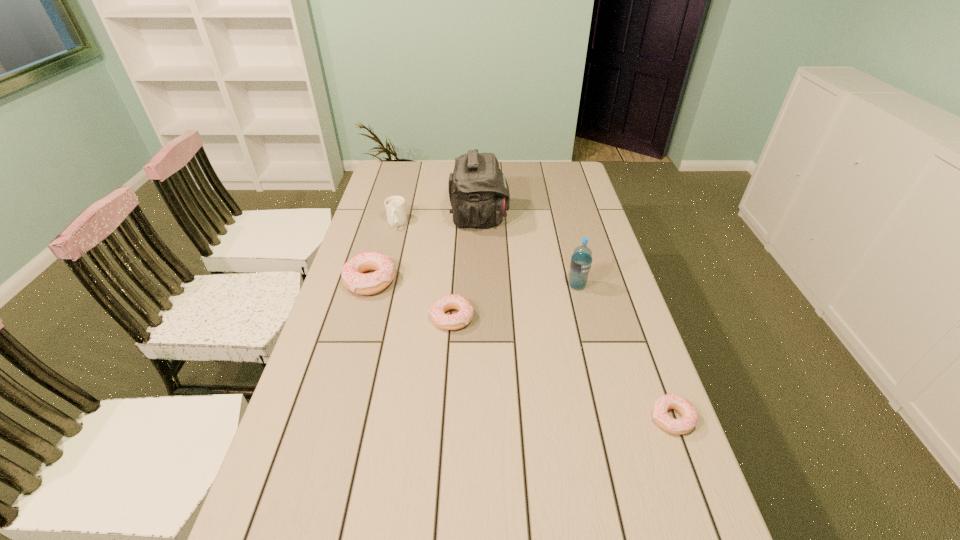
Find the location of a particular element. Image resolution: width=960 pixels, height=540 pixels. vacant position in the image that satisfies the following two spatial constraints: 1. on the open flap of the tallest object; 2. on the back side of the fifth object from left to right is located at coordinates coord(479,286).